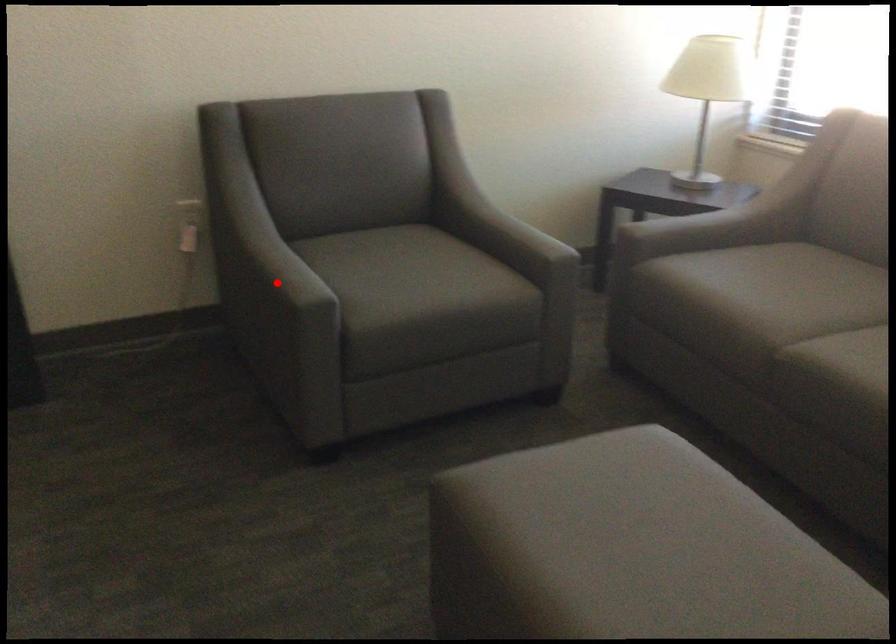
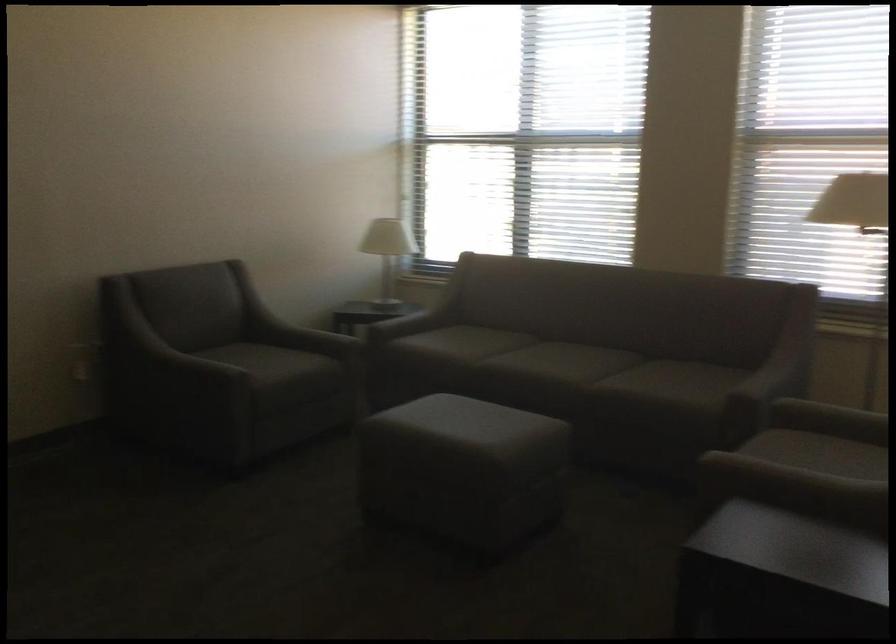
Find the pixel in the second image that matches the highlighted location in the first image.

(197, 368)